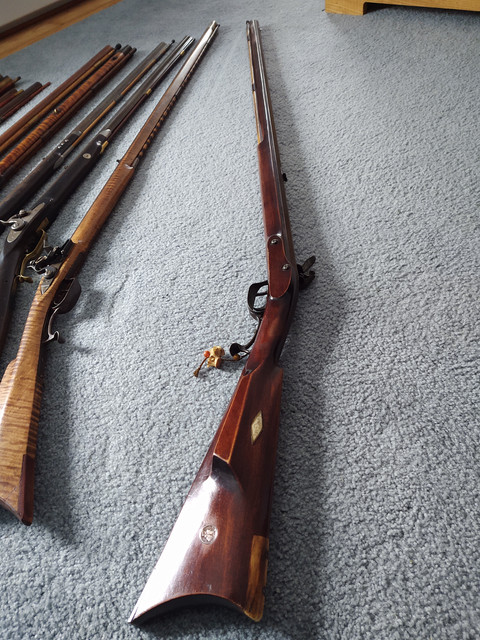
Locate an element on the screen. This screenshot has height=640, width=480. wood floor is located at coordinates (34, 27).